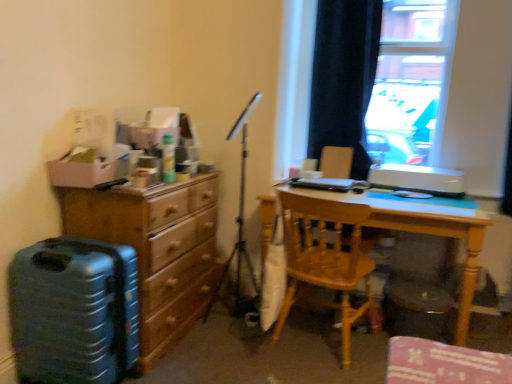
Question: Considering the relative positions of wooden chair at center and metallic tripod at center in the image provided, is wooden chair at center to the right of metallic tripod at center from the viewer's perspective?

Choices:
 (A) no
 (B) yes

Answer: (B)

Question: Is the surface of wooden chair at center in direct contact with metallic tripod at center?

Choices:
 (A) yes
 (B) no

Answer: (B)

Question: Is wooden chair at center taller than metallic tripod at center?

Choices:
 (A) yes
 (B) no

Answer: (B)

Question: Does wooden chair at center have a lesser height compared to metallic tripod at center?

Choices:
 (A) no
 (B) yes

Answer: (B)

Question: Would you say wooden chair at center is outside metallic tripod at center?

Choices:
 (A) no
 (B) yes

Answer: (B)

Question: Is light wood desk at center inside or outside of teal plastic suitcase at left?

Choices:
 (A) outside
 (B) inside

Answer: (A)

Question: In terms of width, does light wood desk at center look wider or thinner when compared to teal plastic suitcase at left?

Choices:
 (A) wide
 (B) thin

Answer: (A)

Question: Is light wood desk at center bigger or smaller than teal plastic suitcase at left?

Choices:
 (A) big
 (B) small

Answer: (A)

Question: In the image, is light wood desk at center positioned in front of or behind teal plastic suitcase at left?

Choices:
 (A) behind
 (B) front

Answer: (A)

Question: Does point (433, 228) appear closer or farther from the camera than point (316, 26)?

Choices:
 (A) farther
 (B) closer

Answer: (B)

Question: From a real-world perspective, is light wood desk at center physically located above or below dark velvet curtain at upper right?

Choices:
 (A) above
 (B) below

Answer: (B)

Question: Is light wood desk at center situated inside dark velvet curtain at upper right or outside?

Choices:
 (A) inside
 (B) outside

Answer: (B)

Question: Would you say light wood desk at center is to the left or to the right of dark velvet curtain at upper right in the picture?

Choices:
 (A) right
 (B) left

Answer: (A)

Question: Is transparent glass window at upper right wider or thinner than wooden chest of drawers at left?

Choices:
 (A) thin
 (B) wide

Answer: (A)

Question: Is transparent glass window at upper right taller or shorter than wooden chest of drawers at left?

Choices:
 (A) tall
 (B) short

Answer: (A)